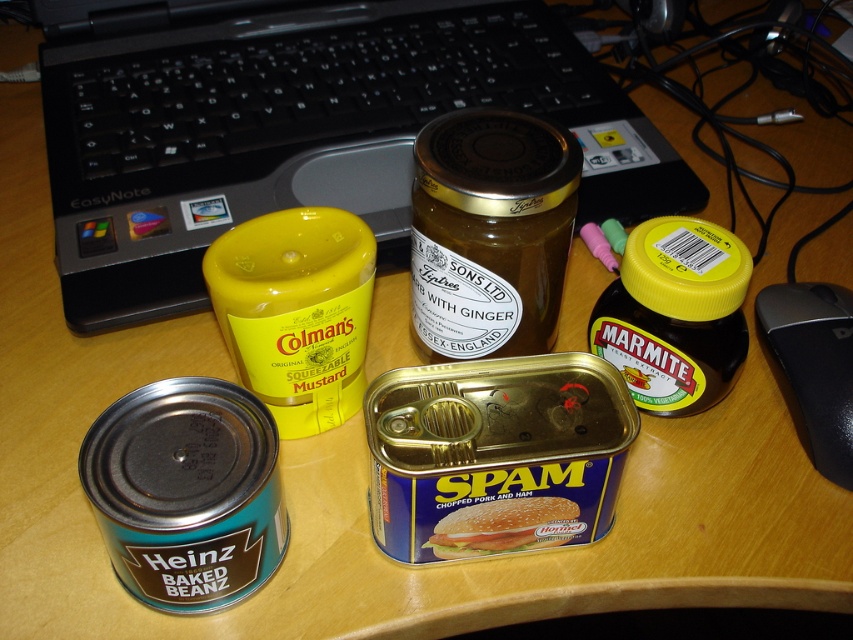
Looking at this image, can you confirm if black plastic laptop at upper left is wider than blue metallic can at center?

Correct, the width of black plastic laptop at upper left exceeds that of blue metallic can at center.

Does point (68, 54) come farther from viewer compared to point (456, 518)?

Yes, point (68, 54) is farther from viewer.

Image resolution: width=853 pixels, height=640 pixels. Identify the location of black plastic laptop at upper left. (305, 132).

Can you confirm if black plastic mouse at right is wider than blue metallic can at center?

No.

The height and width of the screenshot is (640, 853). In order to click on black plastic mouse at right in this screenshot , I will do `click(811, 365)`.

Identify the location of black plastic mouse at right. (811, 365).

Is point (473, 317) in front of point (479, 554)?

That is False.

Is gold glass jar of ginger at center shorter than blue metallic can at center?

In fact, gold glass jar of ginger at center may be taller than blue metallic can at center.

The width and height of the screenshot is (853, 640). What are the coordinates of `gold glass jar of ginger at center` in the screenshot? It's located at (490, 232).

Find the location of a particular element. The width and height of the screenshot is (853, 640). gold glass jar of ginger at center is located at coordinates (490, 232).